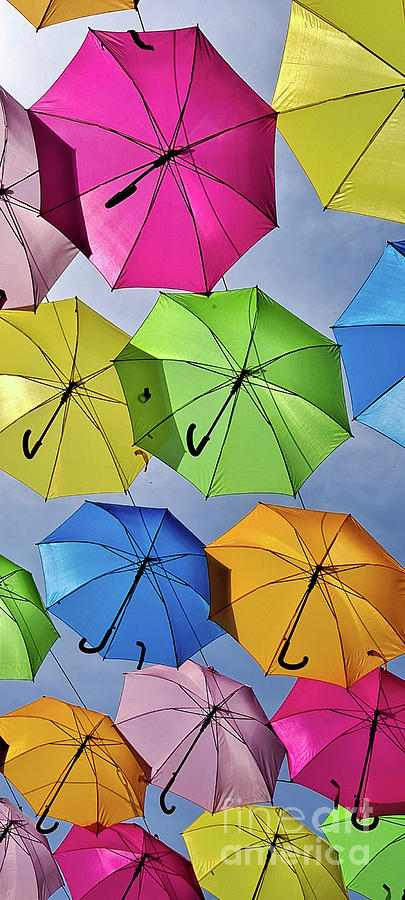
Where is `handle`? The height and width of the screenshot is (900, 405). handle is located at coordinates (166, 805).